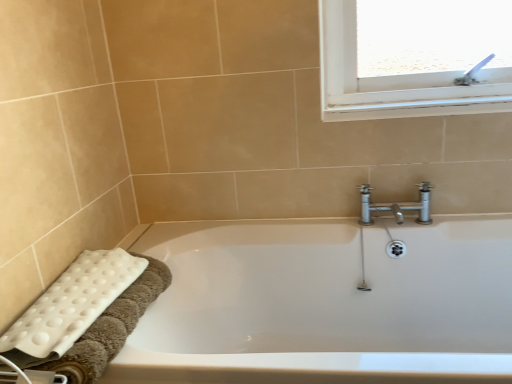
Question: Would you say white plastic towel bar at lower left is to the left or to the right of white glossy bathtub at lower left in the picture?

Choices:
 (A) right
 (B) left

Answer: (B)

Question: Looking at their shapes, would you say white plastic towel bar at lower left is wider or thinner than white glossy bathtub at lower left?

Choices:
 (A) wide
 (B) thin

Answer: (B)

Question: Which of these objects is positioned farthest from the white glossy bathtub at lower left?

Choices:
 (A) white plastic towel bar at lower left
 (B) white textured bath towel at lower left

Answer: (A)

Question: Considering the real-world distances, which object is farthest from the white textured bath towel at lower left?

Choices:
 (A) white plastic towel bar at lower left
 (B) white glossy bathtub at lower left

Answer: (B)